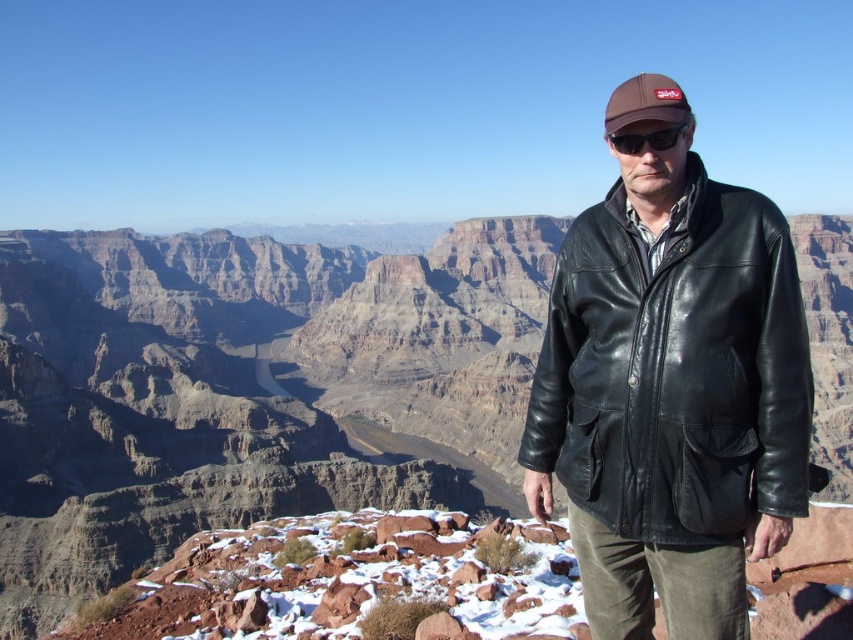
Question: Observing the image, what is the correct spatial positioning of black leather jacket at right in reference to brown leather baseball hat at upper center?

Choices:
 (A) left
 (B) right

Answer: (A)

Question: Which point is farther from the camera taking this photo?

Choices:
 (A) (747, 413)
 (B) (625, 113)
 (C) (654, 144)

Answer: (B)

Question: Which object is the farthest from the rugged rock canyon at center?

Choices:
 (A) black matte sunglasses at center
 (B) black leather jacket at right
 (C) brown leather baseball hat at upper center

Answer: (B)

Question: From the image, what is the correct spatial relationship of rugged rock canyon at center in relation to black matte sunglasses at center?

Choices:
 (A) right
 (B) left

Answer: (B)

Question: Estimate the real-world distances between objects in this image. Which object is farther from the rugged rock canyon at center?

Choices:
 (A) black matte sunglasses at center
 (B) black leather jacket at right
 (C) brown leather baseball hat at upper center

Answer: (B)

Question: In this image, where is rugged rock canyon at center located relative to black leather jacket at right?

Choices:
 (A) left
 (B) right

Answer: (A)